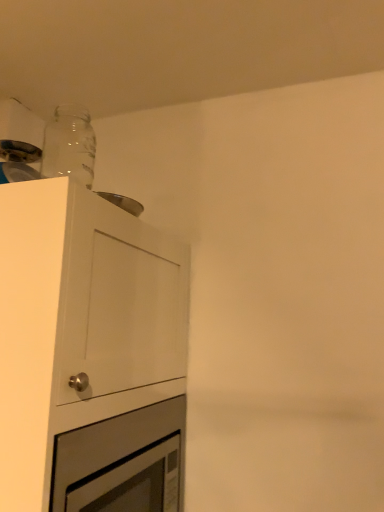
Question: Should I look upward or downward to see white matte cabinet at upper left?

Choices:
 (A) up
 (B) down

Answer: (B)

Question: Is white matte cabinet at upper left bigger than transparent glass bottle at upper left?

Choices:
 (A) yes
 (B) no

Answer: (A)

Question: Is white matte cabinet at upper left in contact with transparent glass bottle at upper left?

Choices:
 (A) no
 (B) yes

Answer: (A)

Question: Is white matte cabinet at upper left positioned behind transparent glass bottle at upper left?

Choices:
 (A) no
 (B) yes

Answer: (A)

Question: Can you confirm if white matte cabinet at upper left is smaller than transparent glass bottle at upper left?

Choices:
 (A) yes
 (B) no

Answer: (B)

Question: Is white matte cabinet at upper left looking in the opposite direction of transparent glass bottle at upper left?

Choices:
 (A) yes
 (B) no

Answer: (B)

Question: Considering the relative sizes of white matte cabinet at upper left and transparent glass bottle at upper left in the image provided, is white matte cabinet at upper left shorter than transparent glass bottle at upper left?

Choices:
 (A) yes
 (B) no

Answer: (B)

Question: Can transparent glass bottle at upper left be found inside silver metallic oven at lower left?

Choices:
 (A) yes
 (B) no

Answer: (B)

Question: Is the depth of silver metallic oven at lower left greater than that of transparent glass bottle at upper left?

Choices:
 (A) no
 (B) yes

Answer: (A)

Question: Can you confirm if silver metallic oven at lower left is taller than transparent glass bottle at upper left?

Choices:
 (A) yes
 (B) no

Answer: (A)

Question: Is silver metallic oven at lower left positioned with its back to transparent glass bottle at upper left?

Choices:
 (A) yes
 (B) no

Answer: (B)

Question: Is silver metallic oven at lower left placed right next to transparent glass bottle at upper left?

Choices:
 (A) yes
 (B) no

Answer: (B)

Question: From a real-world perspective, is silver metallic oven at lower left physically above transparent glass bottle at upper left?

Choices:
 (A) no
 (B) yes

Answer: (A)

Question: Considering the relative sizes of white matte cabinet at upper left and silver metallic oven at lower left in the image provided, is white matte cabinet at upper left smaller than silver metallic oven at lower left?

Choices:
 (A) yes
 (B) no

Answer: (B)